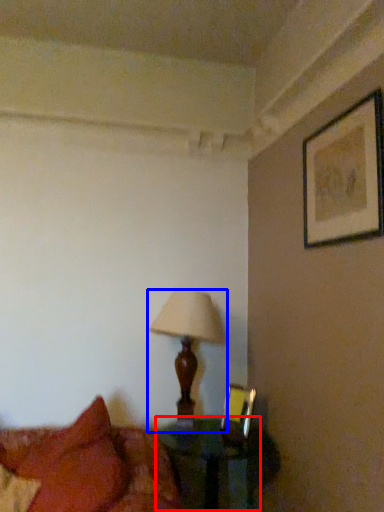
Question: Which object appears closest to the camera in this image, table (highlighted by a red box) or lamp (highlighted by a blue box)?

Choices:
 (A) table
 (B) lamp

Answer: (A)